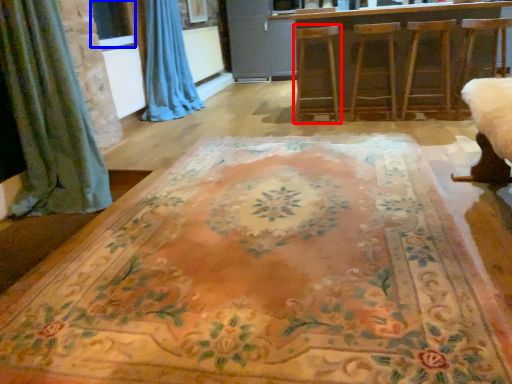
Question: Which of the following is the closest to the observer, armchair (highlighted by a red box) or window screen (highlighted by a blue box)?

Choices:
 (A) armchair
 (B) window screen

Answer: (A)